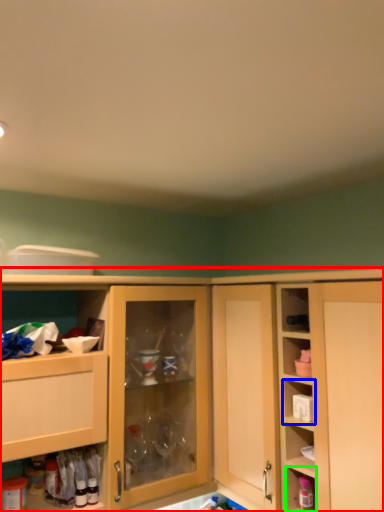
Question: Based on their relative distances, which object is farther from cabinetry (highlighted by a red box)? Choose from shelf (highlighted by a blue box) and cabinet (highlighted by a green box).

Choices:
 (A) shelf
 (B) cabinet

Answer: (B)